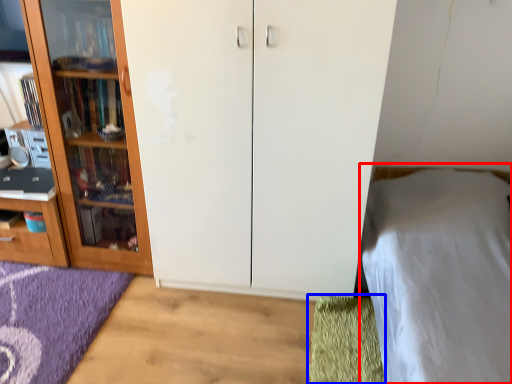
Question: Among these objects, which one is nearest to the camera, bed (highlighted by a red box) or doormat (highlighted by a blue box)?

Choices:
 (A) bed
 (B) doormat

Answer: (A)